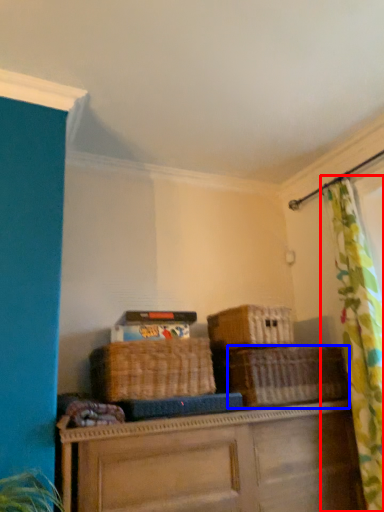
Question: Which object is further to the camera taking this photo, curtain (highlighted by a red box) or basket (highlighted by a blue box)?

Choices:
 (A) curtain
 (B) basket

Answer: (B)